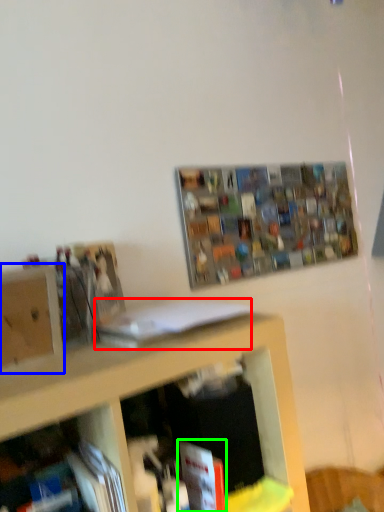
Question: Which object is the closest to the book (highlighted by a red box)? Choose among these: cabinet (highlighted by a blue box) or book (highlighted by a green box).

Choices:
 (A) cabinet
 (B) book

Answer: (A)